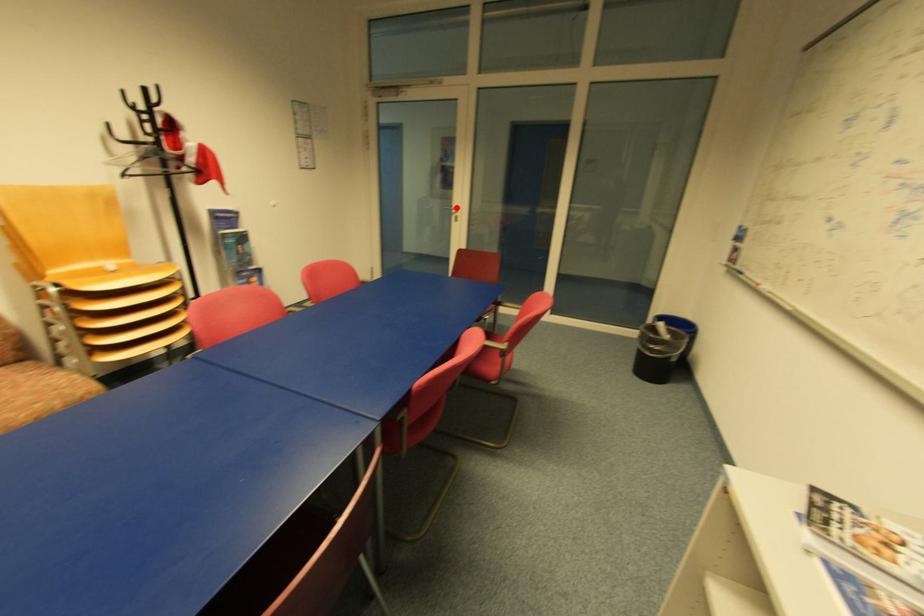
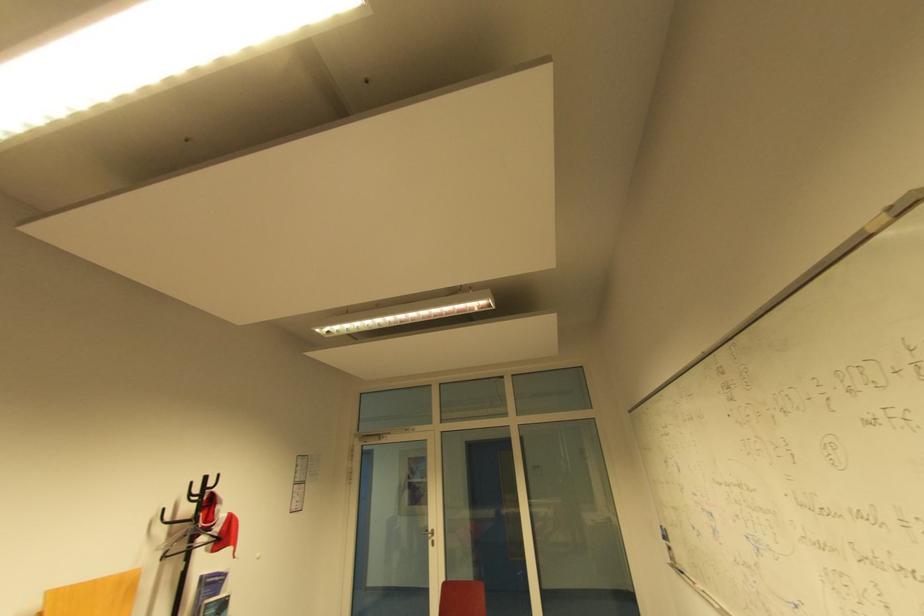
Question: I am providing you with two images of the same scene from different viewpoints. Image1 has a red point marked. In image2, the corresponding 3D location appears at what relative position? Reply with the corresponding letter.

Choices:
 (A) Closer
 (B) Farther

Answer: (B)